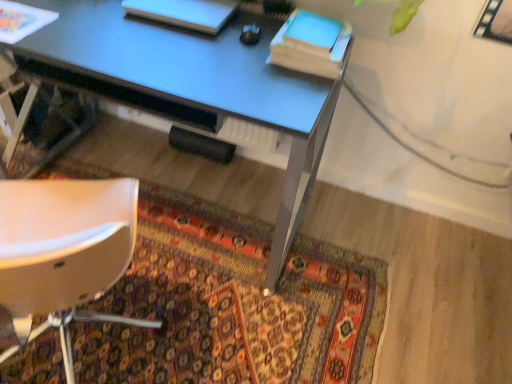
Locate an element on the screen. vacant space that is in between metallic blue desk at center and carpeted rug at lower center is located at coordinates (311, 223).